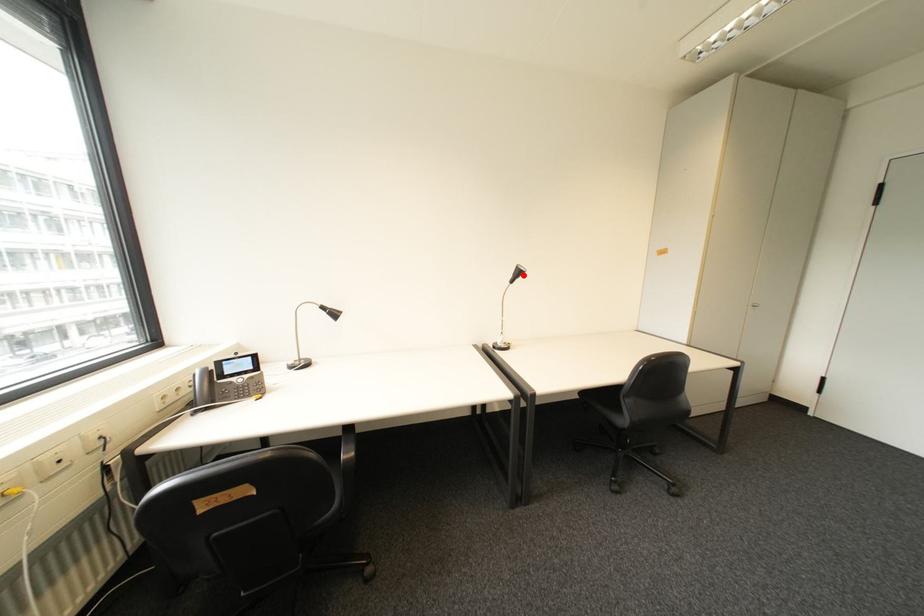
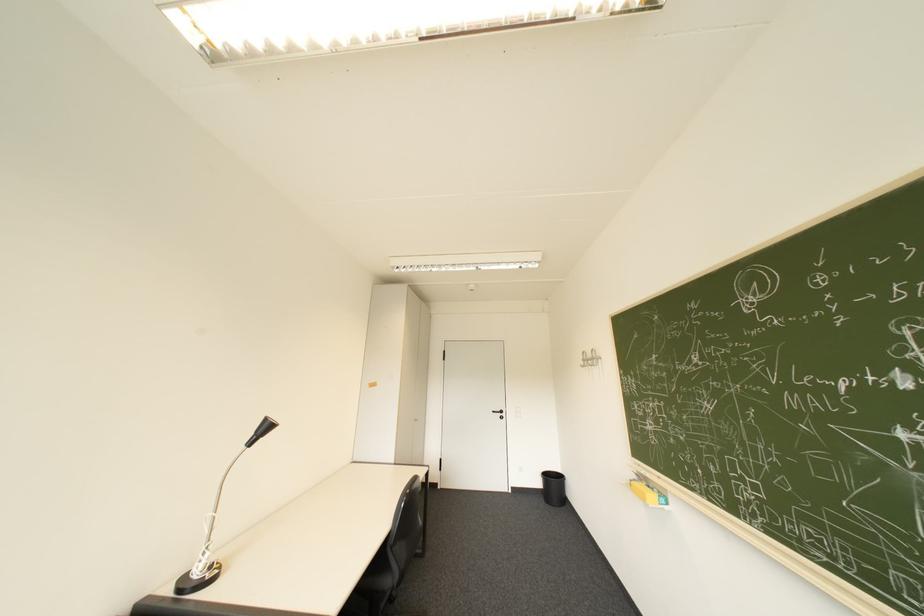
In the second image, find the point that corresponds to the highlighted location in the first image.

(266, 434)